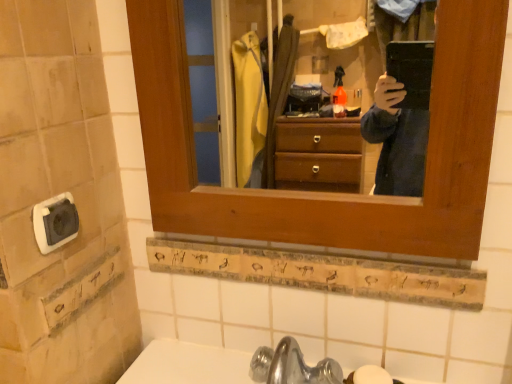
What are the coordinates of `white matte soap at lower center` in the screenshot? It's located at (371, 375).

In order to face white matte soap at lower center, should I rotate leftwards or rightwards?

To align with it, rotate right about 15.456°.

This screenshot has height=384, width=512. Describe the element at coordinates (371, 375) in the screenshot. I see `white matte soap at lower center` at that location.

Where is `white plastic outlet at lower left`? This screenshot has width=512, height=384. white plastic outlet at lower left is located at coordinates (55, 222).

This screenshot has height=384, width=512. Describe the element at coordinates (55, 222) in the screenshot. I see `white plastic outlet at lower left` at that location.

Find the location of a particular element. The height and width of the screenshot is (384, 512). white matte soap at lower center is located at coordinates (371, 375).

Is white matte soap at lower center to the right of white plastic outlet at lower left from the viewer's perspective?

Yes, white matte soap at lower center is to the right of white plastic outlet at lower left.

Does white matte soap at lower center lie behind white plastic outlet at lower left?

Yes, white matte soap at lower center is further from the camera.

Between point (365, 374) and point (65, 242), which one is positioned behind?

The point (365, 374) is behind.

From the image's perspective, which is below, white matte soap at lower center or white plastic outlet at lower left?

white matte soap at lower center, from the image's perspective.

From a real-world perspective, is white matte soap at lower center over white plastic outlet at lower left?

No, from a real-world perspective, white matte soap at lower center is not above white plastic outlet at lower left.

Between white matte soap at lower center and white plastic outlet at lower left, which one has larger width?

With larger width is white matte soap at lower center.

Is white matte soap at lower center taller or shorter than white plastic outlet at lower left?

white matte soap at lower center is shorter than white plastic outlet at lower left.

Which of these two, white matte soap at lower center or white plastic outlet at lower left, is smaller?

white matte soap at lower center is smaller.

Do you think white matte soap at lower center is within white plastic outlet at lower left, or outside of it?

white matte soap at lower center cannot be found inside white plastic outlet at lower left.

Are white matte soap at lower center and white plastic outlet at lower left beside each other?

No, white matte soap at lower center is not in contact with white plastic outlet at lower left.

Is white matte soap at lower center oriented away from white plastic outlet at lower left?

That's not correct — white matte soap at lower center is not looking away from white plastic outlet at lower left.

How many degrees apart are the facing directions of white matte soap at lower center and white plastic outlet at lower left?

The facing directions of white matte soap at lower center and white plastic outlet at lower left are 91.3 degrees apart.

Identify the location of knob in front of the white matte soap at lower center. (55, 222).

Between white plastic outlet at lower left and white matte soap at lower center, which one appears on the right side from the viewer's perspective?

From the viewer's perspective, white matte soap at lower center appears more on the right side.

Relative to white matte soap at lower center, is white plastic outlet at lower left in front or behind?

white plastic outlet at lower left is positioned closer to the viewer than white matte soap at lower center.

Considering the points (54, 225) and (366, 381), which point is behind, point (54, 225) or point (366, 381)?

Positioned behind is point (366, 381).

From the image's perspective, would you say white plastic outlet at lower left is shown under white matte soap at lower center?

Incorrect, from the image's perspective, white plastic outlet at lower left is higher than white matte soap at lower center.

From a real-world perspective, which is physically above, white plastic outlet at lower left or white matte soap at lower center?

white plastic outlet at lower left.

Between white plastic outlet at lower left and white matte soap at lower center, which one has larger width?

white matte soap at lower center is wider.

Is white plastic outlet at lower left shorter than white matte soap at lower center?

In fact, white plastic outlet at lower left may be taller than white matte soap at lower center.

Is white plastic outlet at lower left bigger or smaller than white matte soap at lower center?

In the image, white plastic outlet at lower left appears to be larger than white matte soap at lower center.

Is white plastic outlet at lower left situated inside white matte soap at lower center or outside?

white plastic outlet at lower left is located beyond the bounds of white matte soap at lower center.

Does white plastic outlet at lower left touch white matte soap at lower center?

white plastic outlet at lower left and white matte soap at lower center are not in contact.

Is white plastic outlet at lower left facing away from white matte soap at lower center?

white plastic outlet at lower left is not turned away from white matte soap at lower center.

Measure the distance between white plastic outlet at lower left and white matte soap at lower center.

white plastic outlet at lower left and white matte soap at lower center are 22.36 inches apart from each other.

Where is `knob lying on the left of white matte soap at lower center`? The image size is (512, 384). knob lying on the left of white matte soap at lower center is located at coordinates (55, 222).

You are a GUI agent. You are given a task and a screenshot of the screen. Output one action in this format:
    pyautogui.click(x=<x>, y=<y>)
    Task: Click on the knob on the left of white matte soap at lower center
    This screenshot has height=384, width=512.
    Given the screenshot: What is the action you would take?
    pyautogui.click(x=55, y=222)

Find the location of a particular element. This screenshot has height=384, width=512. soap on the right of white plastic outlet at lower left is located at coordinates (371, 375).